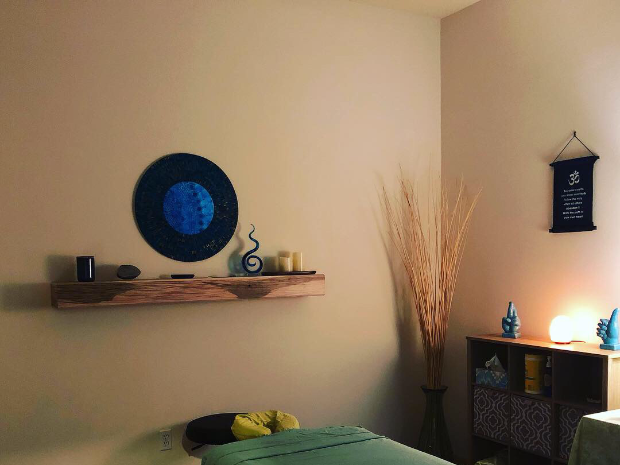
The height and width of the screenshot is (465, 620). What are the coordinates of `sheet on top of massage table` in the screenshot? It's located at (324, 454).